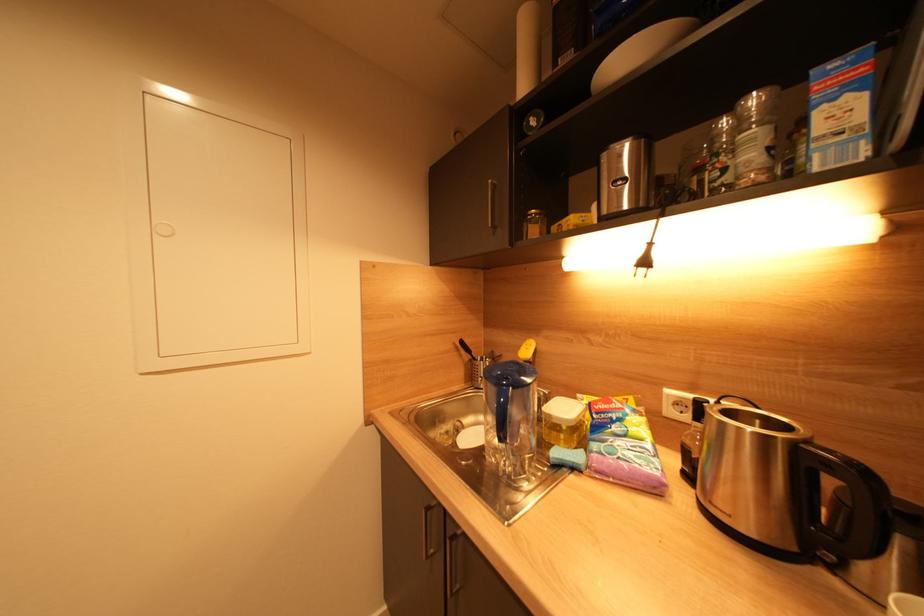
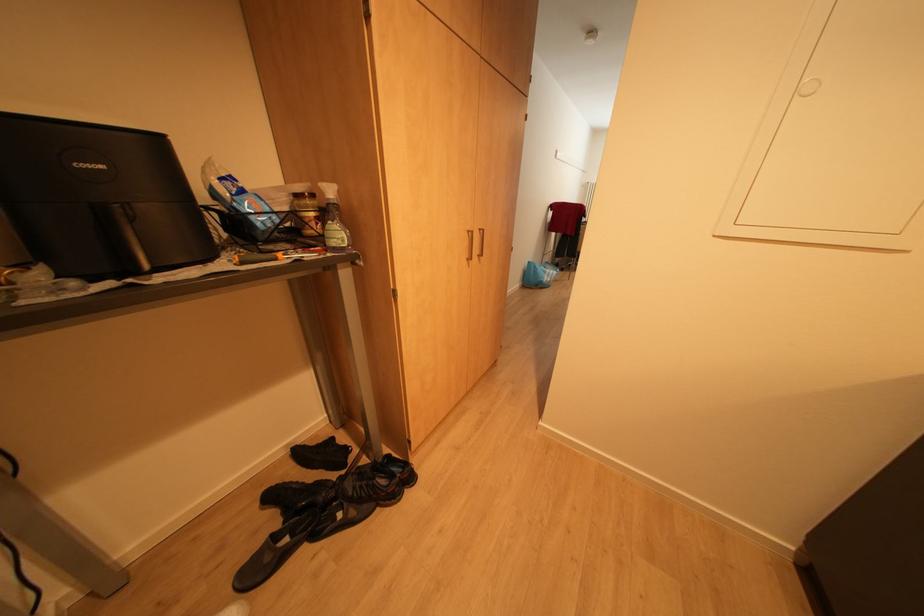
The first image is from the beginning of the video and the second image is from the end. How did the camera likely rotate when shooting the video?

The rotation direction of the camera is left-down.